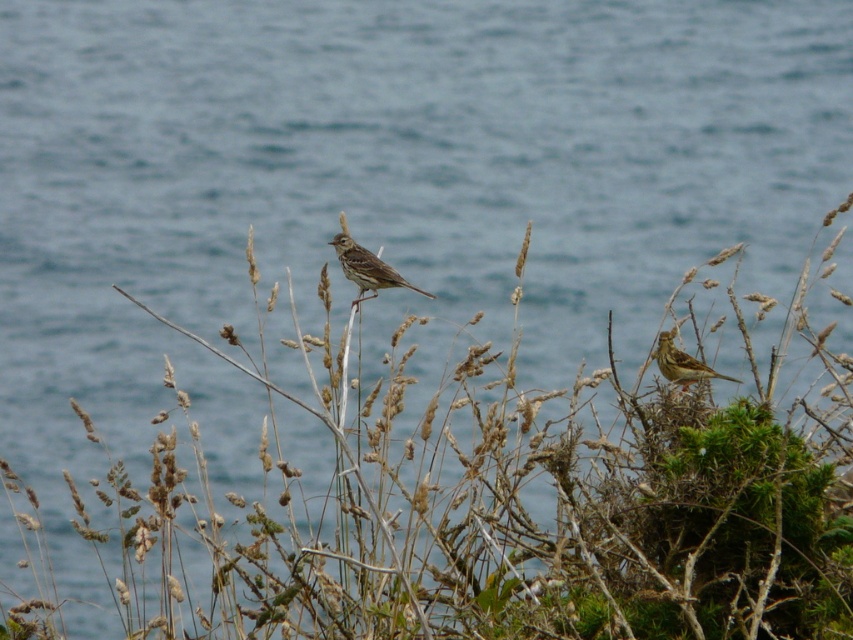
Question: Is brown speckled sparrow at center below brown speckled sparrow at right?

Choices:
 (A) no
 (B) yes

Answer: (A)

Question: Is the position of brown speckled sparrow at center more distant than that of brown speckled sparrow at right?

Choices:
 (A) yes
 (B) no

Answer: (A)

Question: Is brown speckled sparrow at center above brown speckled sparrow at right?

Choices:
 (A) no
 (B) yes

Answer: (B)

Question: Which point is closer to the camera?

Choices:
 (A) brown speckled sparrow at center
 (B) brown speckled sparrow at right

Answer: (B)

Question: Which point is farther from the camera taking this photo?

Choices:
 (A) (392, 285)
 (B) (676, 364)

Answer: (A)